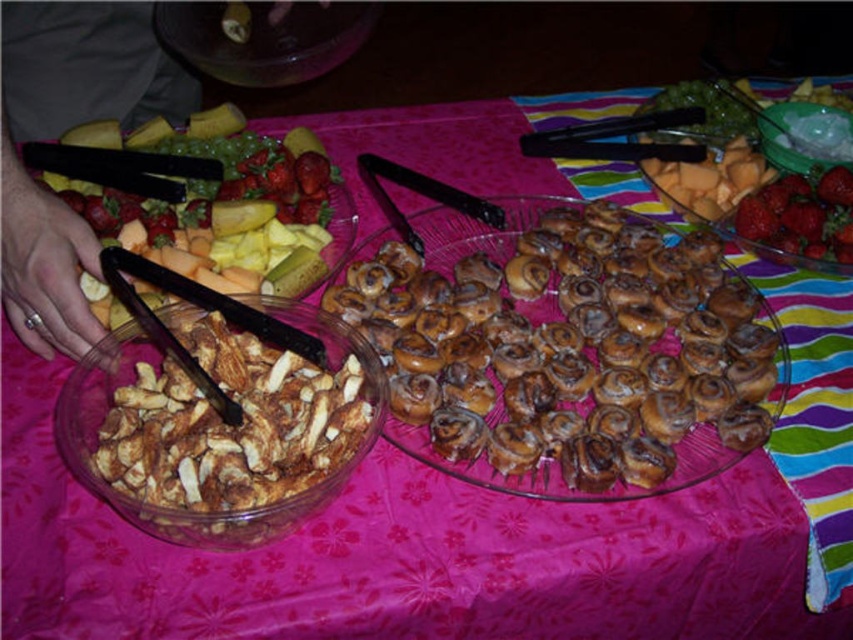
You are a guest at a party and want to grab some strawberries from the red glossy strawberries at upper right. However, there is brown crumbly bread at lower left blocking your view. Can you see the strawberries clearly?

The brown crumbly bread at lower left is in front of red glossy strawberries at upper right, so the strawberries are partially blocked and not clearly visible.

You are planning to serve a dessert platter and need to know which item has a greater width between the golden brown glazed pastry at center and the brown crumbly bread at lower left. Which one should you choose?

The golden brown glazed pastry at center has a greater width than the brown crumbly bread at lower left, so you should choose the golden brown glazed pastry at center for the dessert platter.

You are a guest at a party and want to grab both the golden brown glazed pastry at center and the red glossy strawberries at upper right. Which one do you need to reach over first?

You need to reach over the red glossy strawberries at upper right first because the golden brown glazed pastry at center is located below it.